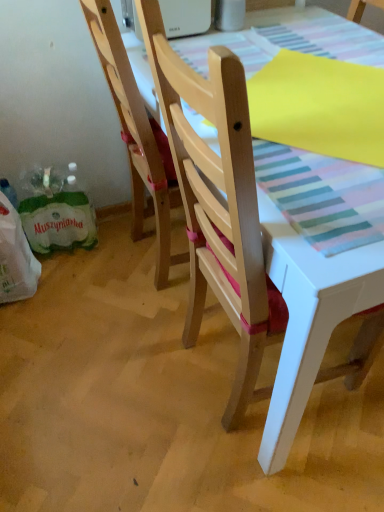
The width and height of the screenshot is (384, 512). In order to click on space that is in front of wooden chair at center, acting as the first chair starting from the right in this screenshot , I will do click(x=267, y=480).